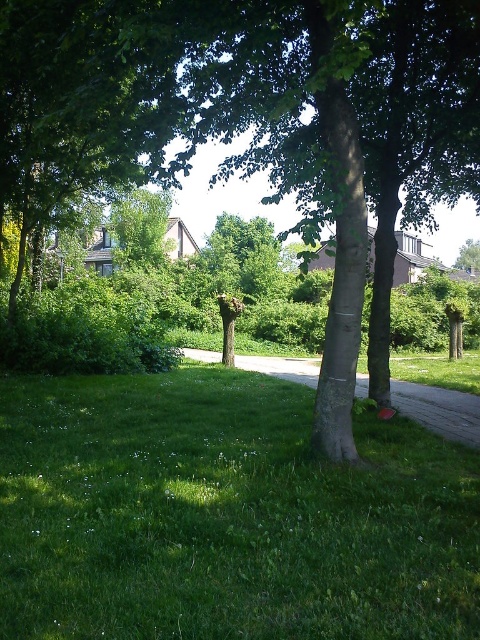
You are standing in the suburban scene and want to walk from the green grass at lower left to the green leafy tree at center. Which direction should you move to get closer to the tree?

To get closer to the green leafy tree at center, you should move away from the green grass at lower left since it is closer to the viewer than the tree.

Based on the photo, you are standing in the suburban scene and want to walk from the green grass at lower left to the green leafy tree at center. Which direction should you move to reach the tree?

You should move to the right to reach the green leafy tree at center from the green grass at lower left, as the grass is located to the left of the tree.